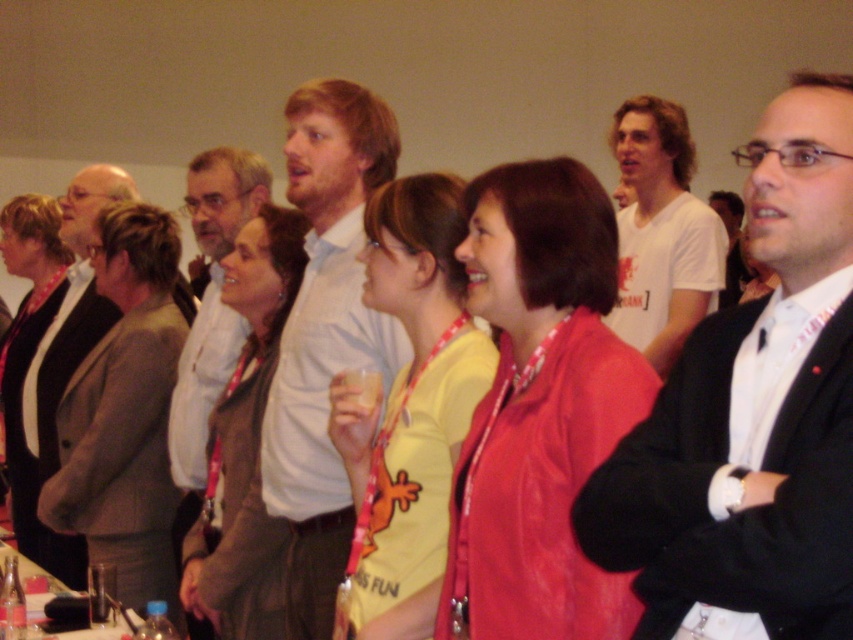
You are at a social event and need to locate two people wearing a yellow fabric shirt at center and a brown leather jacket at center. Which one is positioned higher in the image?

The yellow fabric shirt at center is located above the brown leather jacket at center in the image.

You are a photographer at a social event and need to capture a photo that includes both the black suit at right and the yellow fabric shirt at center. Based on their positions, which one should you focus on first to ensure both are in the frame?

The black suit at right is located above the yellow fabric shirt at center, so you should focus on the yellow fabric shirt at center first to ensure both are in the frame.